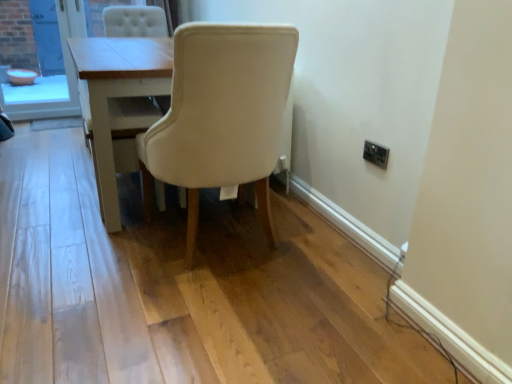
Question: Is light wood table at center thinner than beige fabric chair at center?

Choices:
 (A) no
 (B) yes

Answer: (B)

Question: From the image's perspective, is light wood table at center below beige fabric chair at center?

Choices:
 (A) no
 (B) yes

Answer: (A)

Question: From a real-world perspective, is light wood table at center positioned over beige fabric chair at center based on gravity?

Choices:
 (A) no
 (B) yes

Answer: (A)

Question: From a real-world perspective, is light wood table at center under beige fabric chair at center?

Choices:
 (A) yes
 (B) no

Answer: (A)

Question: Considering the relative sizes of light wood table at center and beige fabric chair at center in the image provided, is light wood table at center shorter than beige fabric chair at center?

Choices:
 (A) yes
 (B) no

Answer: (A)

Question: In terms of height, does beige fabric chair at center look taller or shorter compared to light wood table at center?

Choices:
 (A) short
 (B) tall

Answer: (B)

Question: Does point (286, 26) appear closer or farther from the camera than point (119, 43)?

Choices:
 (A) farther
 (B) closer

Answer: (B)

Question: In terms of size, does beige fabric chair at center appear bigger or smaller than light wood table at center?

Choices:
 (A) big
 (B) small

Answer: (A)

Question: From the image's perspective, is beige fabric chair at center located above or below light wood table at center?

Choices:
 (A) above
 (B) below

Answer: (B)

Question: Visually, is orange plastic bowl at left positioned to the left or to the right of beige fabric chair at center?

Choices:
 (A) right
 (B) left

Answer: (B)

Question: Which is correct: orange plastic bowl at left is inside beige fabric chair at center, or outside of it?

Choices:
 (A) inside
 (B) outside

Answer: (B)

Question: In terms of height, does orange plastic bowl at left look taller or shorter compared to beige fabric chair at center?

Choices:
 (A) short
 (B) tall

Answer: (A)

Question: From the image's perspective, is orange plastic bowl at left positioned above or below beige fabric chair at center?

Choices:
 (A) below
 (B) above

Answer: (B)

Question: Does point (133, 96) appear closer or farther from the camera than point (372, 153)?

Choices:
 (A) farther
 (B) closer

Answer: (A)

Question: Considering the positions of light wood table at center and black plastic electric outlet at upper right in the image, is light wood table at center bigger or smaller than black plastic electric outlet at upper right?

Choices:
 (A) small
 (B) big

Answer: (B)